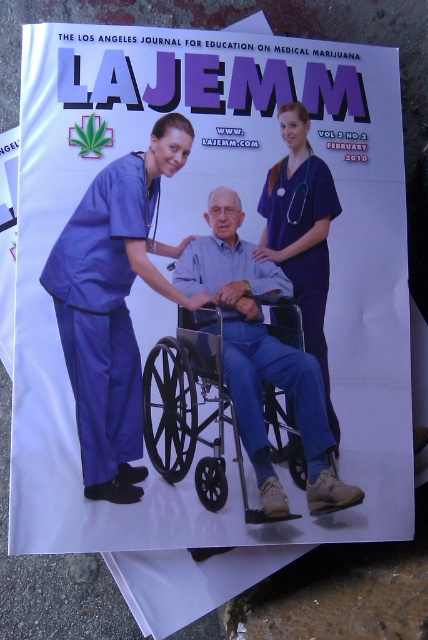
Question: Does matte blue scrubs at left have a smaller size compared to matte blue scrubs at center?

Choices:
 (A) no
 (B) yes

Answer: (A)

Question: Can you confirm if matte blue scrubs at left is positioned below matte blue scrubs at center?

Choices:
 (A) yes
 (B) no

Answer: (A)

Question: Which point is closer to the camera?

Choices:
 (A) (77, 298)
 (B) (329, 392)
 (C) (284, 454)

Answer: (A)

Question: Can you confirm if matte blue scrubs at left is positioned to the right of matte blue scrubs at center?

Choices:
 (A) no
 (B) yes

Answer: (A)

Question: Which object is closer to the camera taking this photo?

Choices:
 (A) matte blue scrubs at center
 (B) matte blue scrubs at left
 (C) metallic silver wheelchair at center

Answer: (B)

Question: Which of the following is the closest to the observer?

Choices:
 (A) matte blue scrubs at left
 (B) matte blue scrubs at center

Answer: (A)